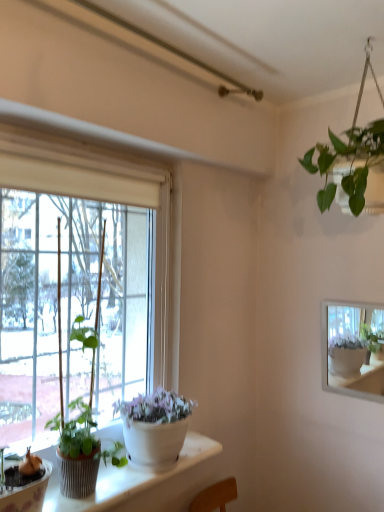
Question: Is transparent glass window at left next to green matte plant at left?

Choices:
 (A) no
 (B) yes

Answer: (A)

Question: Can you confirm if transparent glass window at left is taller than green matte plant at left?

Choices:
 (A) no
 (B) yes

Answer: (B)

Question: Does transparent glass window at left have a greater width compared to green matte plant at left?

Choices:
 (A) no
 (B) yes

Answer: (B)

Question: Is transparent glass window at left outside of green matte plant at left?

Choices:
 (A) no
 (B) yes

Answer: (B)

Question: From the image's perspective, is transparent glass window at left on top of green matte plant at left?

Choices:
 (A) no
 (B) yes

Answer: (B)

Question: Is transparent glass window at left in front of green matte plant at left?

Choices:
 (A) yes
 (B) no

Answer: (A)

Question: Is there a large distance between green matte plant at left and transparent glass window at left?

Choices:
 (A) yes
 (B) no

Answer: (B)

Question: Is green matte plant at left positioned in front of transparent glass window at left?

Choices:
 (A) no
 (B) yes

Answer: (A)

Question: From a real-world perspective, does green matte plant at left sit lower than transparent glass window at left?

Choices:
 (A) yes
 (B) no

Answer: (A)

Question: From the image's perspective, does green matte plant at left appear higher than transparent glass window at left?

Choices:
 (A) yes
 (B) no

Answer: (B)

Question: Is green matte plant at left to the left of transparent glass window at left from the viewer's perspective?

Choices:
 (A) yes
 (B) no

Answer: (A)

Question: Does green matte plant at left have a lesser width compared to transparent glass window at left?

Choices:
 (A) yes
 (B) no

Answer: (A)

Question: Considering their positions, is green matte plant at left located in front of or behind transparent glass window at left?

Choices:
 (A) front
 (B) behind

Answer: (B)